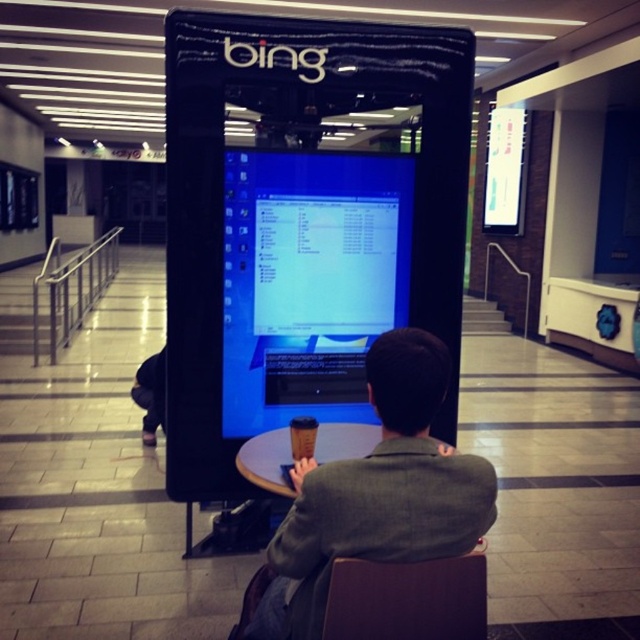
You are a maintenance worker needing to clean the blue glossy monitor at center and the dark gray suit at center. Which object requires a wider cleaning cloth?

The blue glossy monitor at center requires a wider cleaning cloth because its width surpasses that of the dark gray suit at center.

You are a maintenance worker needing to replace a part on the taller object between the blue glossy monitor at center and the brown leather chair at lower center. Which object should you focus on?

The blue glossy monitor at center is taller than the brown leather chair at lower center, so you should focus on the blue glossy monitor at center for the repair.